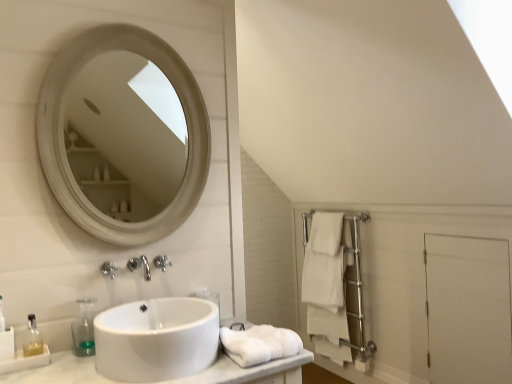
Question: In which direction should I rotate to look at satin nickel faucet at center, acting as the 1th faucet starting from the left?

Choices:
 (A) right
 (B) left

Answer: (B)

Question: Is transparent plastic soap dispenser at lower left, positioned as the first soap dispenser in right-to-left order, taller than silver metallic faucet at lower center, which appears as the 2th faucet when viewed from the left?

Choices:
 (A) no
 (B) yes

Answer: (B)

Question: Is the depth of transparent plastic soap dispenser at lower left, the second soap dispenser when ordered from left to right, greater than that of silver metallic faucet at lower center, which appears as the 2th faucet when viewed from the left?

Choices:
 (A) no
 (B) yes

Answer: (A)

Question: Is transparent plastic soap dispenser at lower left, positioned as the first soap dispenser in right-to-left order, located outside silver metallic faucet at lower center, arranged as the first faucet when viewed from the back?

Choices:
 (A) no
 (B) yes

Answer: (B)

Question: Can you confirm if transparent plastic soap dispenser at lower left, positioned as the first soap dispenser in right-to-left order, is thinner than silver metallic faucet at lower center, which appears as the 2th faucet when viewed from the left?

Choices:
 (A) yes
 (B) no

Answer: (B)

Question: Is transparent plastic soap dispenser at lower left, positioned as the first soap dispenser in right-to-left order, wider than silver metallic faucet at lower center, arranged as the first faucet when viewed from the back?

Choices:
 (A) yes
 (B) no

Answer: (A)

Question: Is transparent plastic soap dispenser at lower left, positioned as the first soap dispenser in right-to-left order, to the right of silver metallic faucet at lower center, which appears as the 2th faucet when viewed from the left, from the viewer's perspective?

Choices:
 (A) no
 (B) yes

Answer: (A)

Question: Is the depth of silver metallic faucet at lower center, acting as the second faucet starting from the front, greater than that of white matte bath towel at lower center, the first bath towel from the top?

Choices:
 (A) no
 (B) yes

Answer: (B)

Question: Would you consider silver metallic faucet at lower center, which appears as the 2th faucet when viewed from the left, to be distant from white matte bath towel at lower center, marked as the second bath towel in a bottom-to-top arrangement?

Choices:
 (A) yes
 (B) no

Answer: (B)

Question: Considering the relative sizes of silver metallic faucet at lower center, the first faucet in the right-to-left sequence, and white matte bath towel at lower center, the first bath towel from the top, in the image provided, is silver metallic faucet at lower center, the first faucet in the right-to-left sequence, taller than white matte bath towel at lower center, the first bath towel from the top,?

Choices:
 (A) no
 (B) yes

Answer: (A)

Question: Considering the relative sizes of silver metallic faucet at lower center, acting as the second faucet starting from the front, and white matte bath towel at lower center, marked as the first bath towel in a left-to-right arrangement, in the image provided, is silver metallic faucet at lower center, acting as the second faucet starting from the front, thinner than white matte bath towel at lower center, marked as the first bath towel in a left-to-right arrangement,?

Choices:
 (A) yes
 (B) no

Answer: (A)

Question: From a real-world perspective, is silver metallic faucet at lower center, arranged as the first faucet when viewed from the back, beneath white matte bath towel at lower center, marked as the first bath towel in a left-to-right arrangement?

Choices:
 (A) yes
 (B) no

Answer: (B)

Question: Does silver metallic faucet at lower center, the first faucet in the right-to-left sequence, have a greater width compared to white matte bath towel at lower center, which is the 2th bath towel from back to front?

Choices:
 (A) no
 (B) yes

Answer: (A)

Question: Does translucent plastic soap dispenser at lower left, the second soap dispenser when ordered from right to left, have a larger size compared to transparent plastic soap dispenser at lower left, positioned as the first soap dispenser in right-to-left order?

Choices:
 (A) no
 (B) yes

Answer: (A)